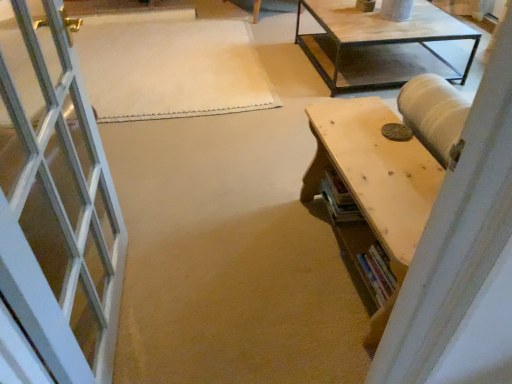
The width and height of the screenshot is (512, 384). Find the location of `white woven mat at center`. white woven mat at center is located at coordinates (170, 66).

Image resolution: width=512 pixels, height=384 pixels. Describe the element at coordinates (170, 66) in the screenshot. I see `white woven mat at center` at that location.

In order to face wooden table at right, should I rotate leftwards or rightwards?

Rotate your view right by about 15.418°.

This screenshot has height=384, width=512. What do you see at coordinates (371, 188) in the screenshot?
I see `wooden table at right` at bounding box center [371, 188].

Where is `wooden table at right`? The height and width of the screenshot is (384, 512). wooden table at right is located at coordinates 371,188.

Image resolution: width=512 pixels, height=384 pixels. I want to click on white woven mat at center, so click(170, 66).

Considering the positions of objects white woven mat at center and wooden table at right in the image provided, who is more to the right, white woven mat at center or wooden table at right?

Positioned to the right is wooden table at right.

In the image, is white woven mat at center positioned in front of or behind wooden table at right?

In the image, white woven mat at center appears behind wooden table at right.

Which is behind, point (193, 40) or point (346, 102)?

The point (193, 40) is more distant.

From the image's perspective, is white woven mat at center under wooden table at right?

Actually, white woven mat at center appears above wooden table at right in the image.

From a real-world perspective, is white woven mat at center on wooden table at right?

No, from a real-world perspective, white woven mat at center is not over wooden table at right

Considering the sizes of objects white woven mat at center and wooden table at right in the image provided, who is thinner, white woven mat at center or wooden table at right?

wooden table at right is thinner.

From the picture: Which of these two, white woven mat at center or wooden table at right, stands shorter?

white woven mat at center is shorter.

Between white woven mat at center and wooden table at right, which one has larger size?

Bigger between the two is wooden table at right.

Is white woven mat at center completely or partially outside of wooden table at right?

white woven mat at center lies outside wooden table at right's area.

Is white woven mat at center next to wooden table at right and touching it?

white woven mat at center and wooden table at right are clearly separated.

Is white woven mat at center aimed at wooden table at right?

No, white woven mat at center is not facing towards wooden table at right.

How different are the orientations of white woven mat at center and wooden table at right in degrees?

179 degrees separate the facing orientations of white woven mat at center and wooden table at right.

I want to click on mat above the wooden table at right (from the image's perspective), so click(170, 66).

Is wooden table at right to the left or to the right of white woven mat at center in the image?

Based on their positions, wooden table at right is located to the right of white woven mat at center.

Which object is closer to the camera taking this photo, wooden table at right or white woven mat at center?

wooden table at right is in front.

Considering the positions of points (333, 118) and (124, 17), is point (333, 118) closer to camera compared to point (124, 17)?

Yes, it is in front of point (124, 17).

From the image's perspective, between wooden table at right and white woven mat at center, which one is located above?

white woven mat at center appears higher in the image.

From a real-world perspective, which is physically above, wooden table at right or white woven mat at center?

wooden table at right is physically above.

From the picture: Can you confirm if wooden table at right is wider than white woven mat at center?

Incorrect, the width of wooden table at right does not surpass that of white woven mat at center.

Considering the sizes of objects wooden table at right and white woven mat at center in the image provided, who is shorter, wooden table at right or white woven mat at center?

With less height is white woven mat at center.

Does wooden table at right have a larger size compared to white woven mat at center?

Yes, wooden table at right is bigger than white woven mat at center.

Is wooden table at right outside of white woven mat at center?

Indeed, wooden table at right is completely outside white woven mat at center.

Are wooden table at right and white woven mat at center far apart?

Absolutely, wooden table at right is distant from white woven mat at center.

Looking at this image, is wooden table at right aimed at white woven mat at center?

No, wooden table at right is not facing towards white woven mat at center.

At what (x,y) coordinates should I click in order to perform the action: click on mat that is on the left side of wooden table at right. Please return your answer as a coordinate pair (x, y). This screenshot has height=384, width=512. Looking at the image, I should click on (170, 66).

This screenshot has width=512, height=384. I want to click on table on the right of white woven mat at center, so click(x=371, y=188).

This screenshot has height=384, width=512. In order to click on mat above the wooden table at right (from the image's perspective) in this screenshot , I will do `click(170, 66)`.